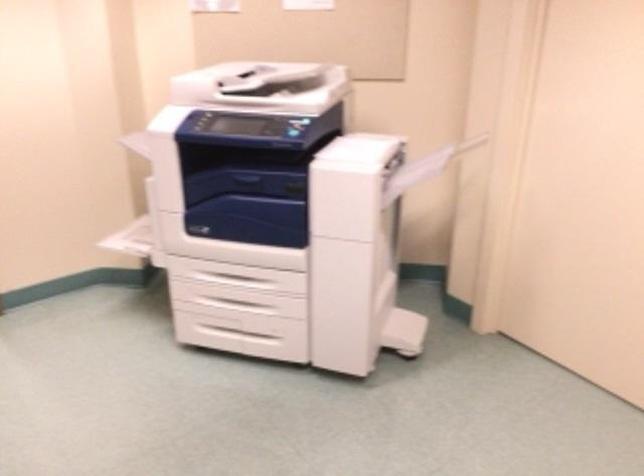
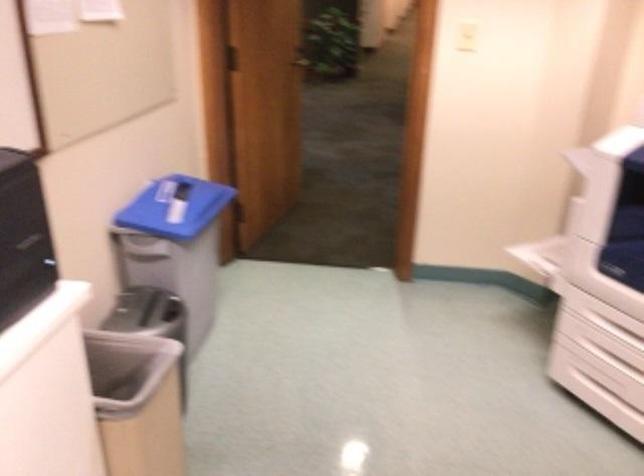
In the second image, find the point that corresponds to pixel 216 300 in the first image.

(611, 359)